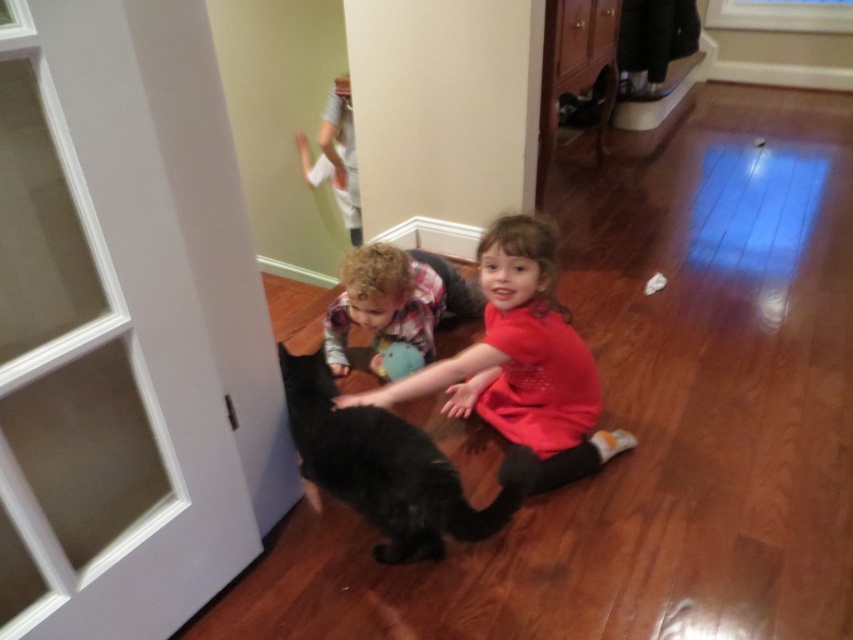
You are a photographer trying to capture the black fluffy cat at center in the image. The cat is currently at point (x=384, y=467). If you want to position the cat exactly at the center of your camera frame, which has a coordinate system where the bottom left corner is 0,0 and the top right corner is 1,1, do you need to move the camera left or right? Please explain your reasoning based on the cat location.

The black fluffy cat at center is located at point (x=384, y=467). Since the center of the camera frame is at 0.5,0.5, the cat is to the right and slightly above the center. To move it to the exact center, you should move the camera to the right so that the cat moves left into the center position.

You are a photographer trying to capture a photo of the fluffy brown dog at center without including the matte red shirt at center in the frame. Given that the camera has a fixed focal length and you can only move closer or farther from the scene, is it possible to achieve this?

The matte red shirt at center and fluffy brown dog at center are 14.67 inches apart. Since they are positioned very close to each other at center, moving closer or farther might not separate them enough in the frame. It might not be possible to exclude the matte red shirt at center while keeping the fluffy brown dog at center in the shot.